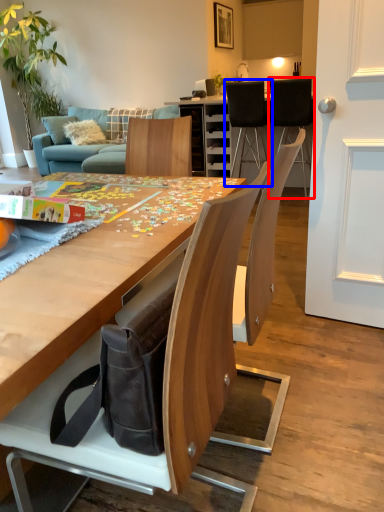
Question: Which object appears farthest to the camera in this image, chair (highlighted by a red box) or chair (highlighted by a blue box)?

Choices:
 (A) chair
 (B) chair

Answer: (B)